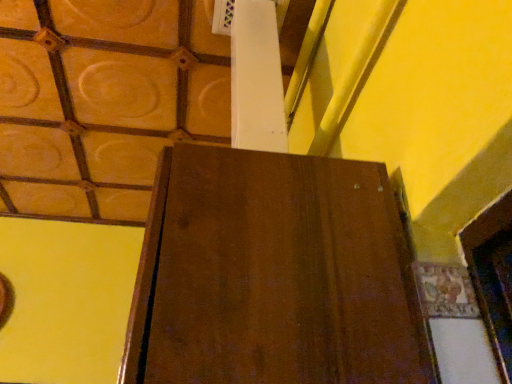
Describe the element at coordinates (274, 275) in the screenshot. I see `brown matte door at center` at that location.

This screenshot has width=512, height=384. What are the coordinates of `brown matte door at center` in the screenshot? It's located at (x=274, y=275).

The width and height of the screenshot is (512, 384). Find the location of `brown matte door at center`. brown matte door at center is located at coordinates (274, 275).